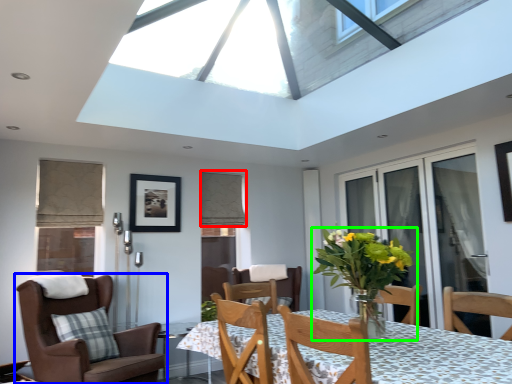
Question: Considering the real-world distances, which object is farthest from curtain (highlighted by a red box)? chair (highlighted by a blue box) or houseplant (highlighted by a green box)?

Choices:
 (A) chair
 (B) houseplant

Answer: (B)